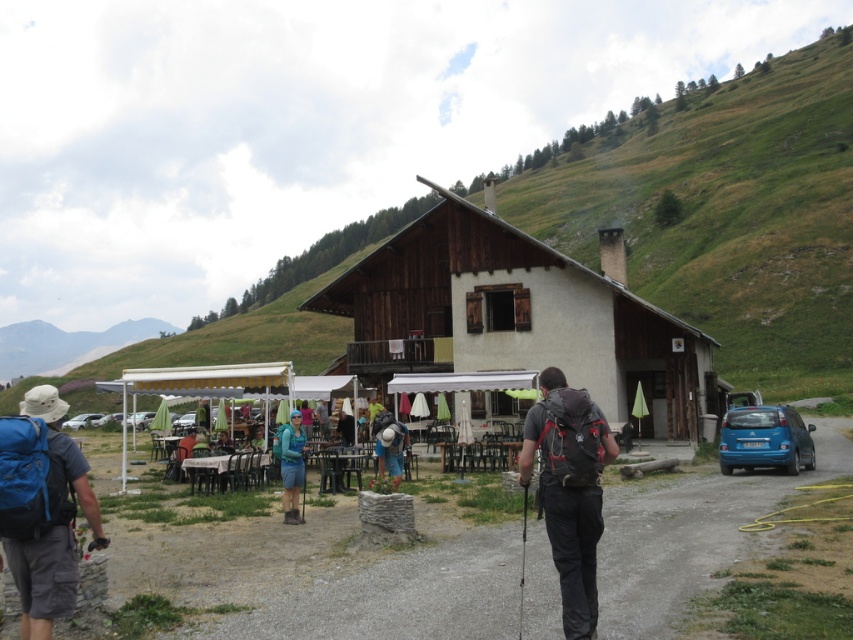
Question: Can you confirm if matte black backpack at center is positioned above blue fabric backpack at center?

Choices:
 (A) yes
 (B) no

Answer: (A)

Question: Which point is closer to the camera?

Choices:
 (A) (399, 452)
 (B) (73, 420)

Answer: (A)

Question: Which of the following is the farthest from the observer?

Choices:
 (A) (86, 422)
 (B) (491, 236)
 (C) (379, 454)
 (D) (99, 532)

Answer: (A)

Question: Does blue matte car at right come behind silver metallic car at lower left?

Choices:
 (A) no
 (B) yes

Answer: (A)

Question: Can you confirm if matte black backpack at center is positioned to the left of blue matte car at right?

Choices:
 (A) no
 (B) yes

Answer: (B)

Question: Which object is farther from the camera taking this photo?

Choices:
 (A) silver metallic car at lower left
 (B) blue fabric backpack at left
 (C) green grassy hillside at upper center

Answer: (A)